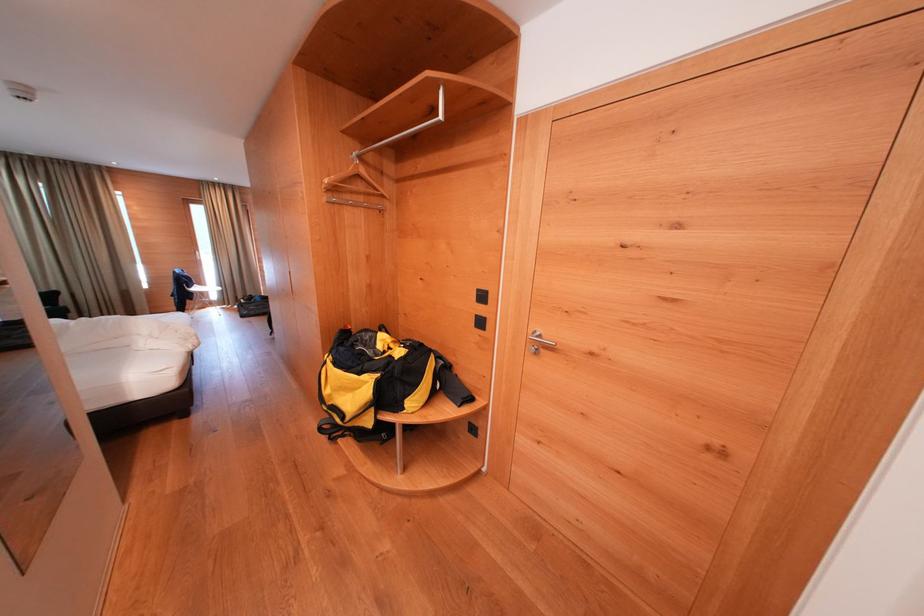
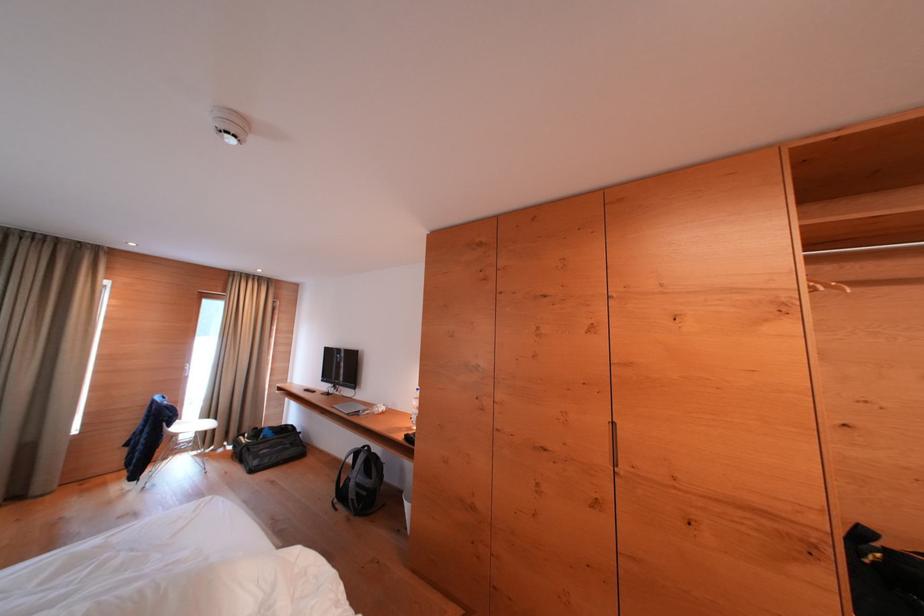
The images are taken continuously from a first-person perspective. In which direction are you moving?

The cameraman walked toward left, forward.